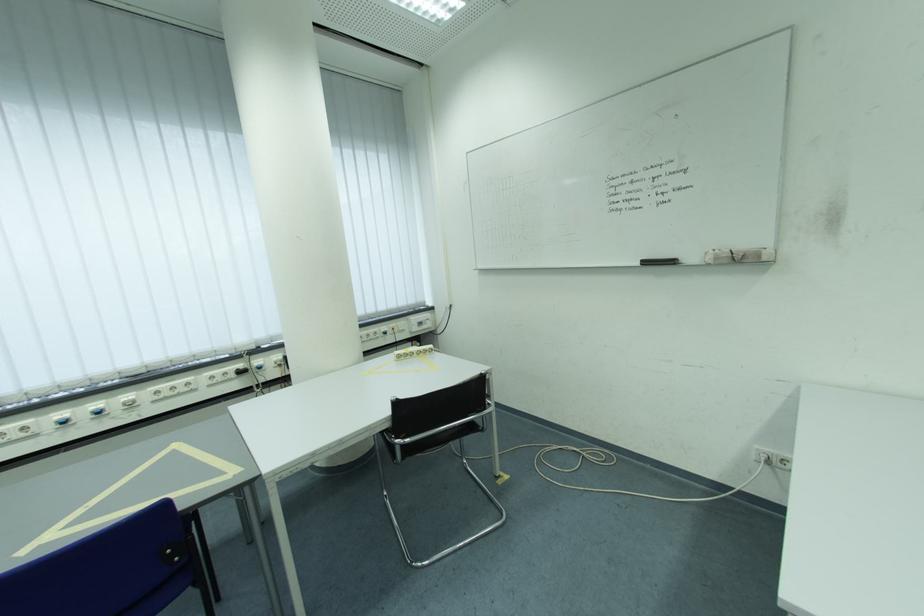
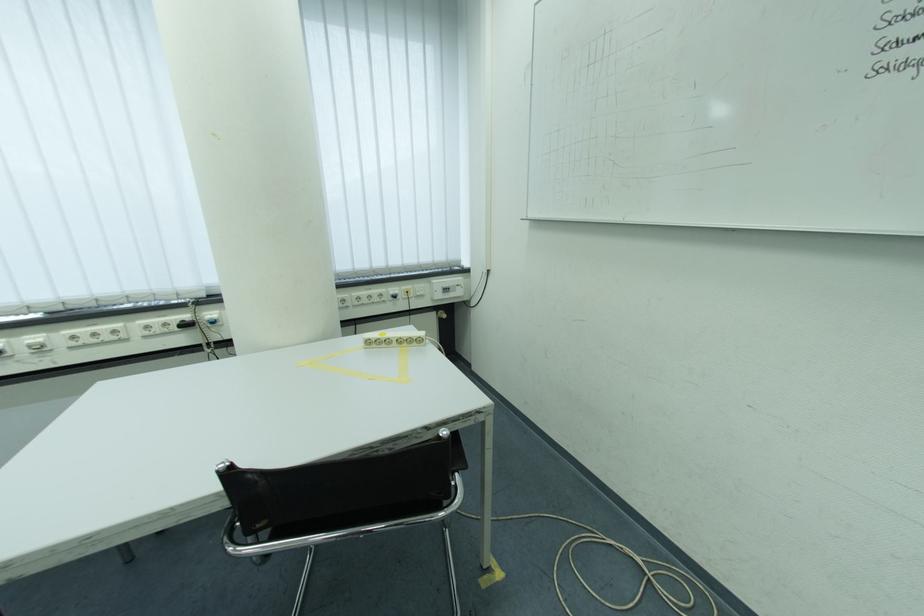
Locate, in the second image, the point that corresponds to point 393,330 in the first image.

(402, 291)